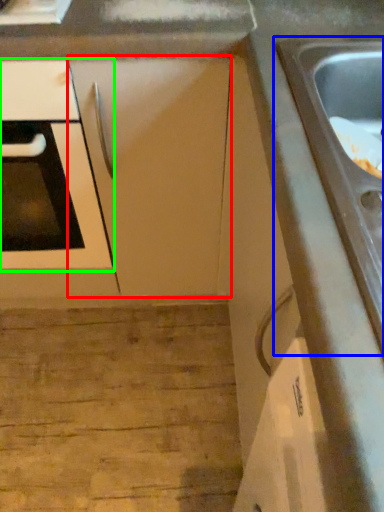
Question: Estimate the real-world distances between objects in this image. Which object is closer to cabinetry (highlighted by a red box), sink (highlighted by a blue box) or oven (highlighted by a green box)?

Choices:
 (A) sink
 (B) oven

Answer: (B)